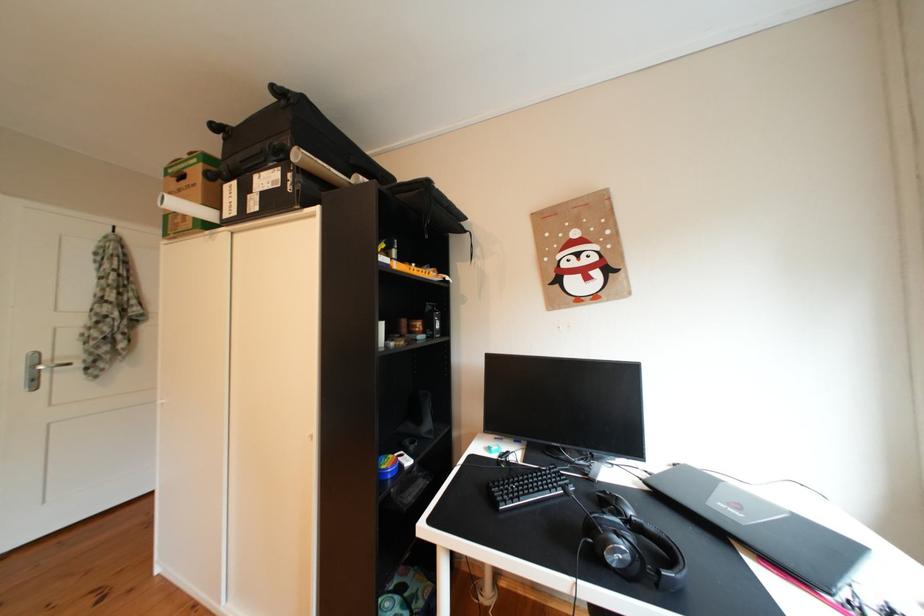
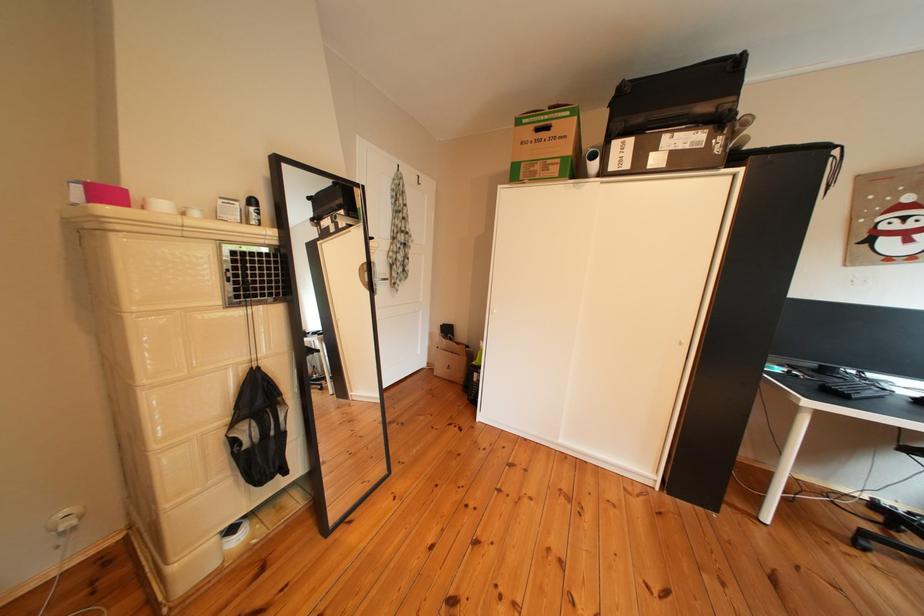
The point at [272,213] is marked in the first image. Where is the corresponding point in the second image?

(676, 169)